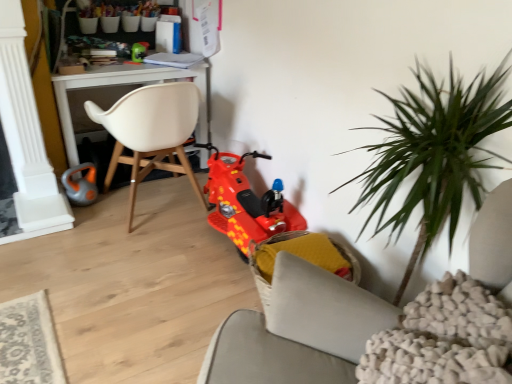
Identify the location of empty space that is in between white matte chair at center, the 1th chair when ordered from top to bottom, and shiny plastic scooter at center, placed as the first toy when sorted from right to left. (194, 248).